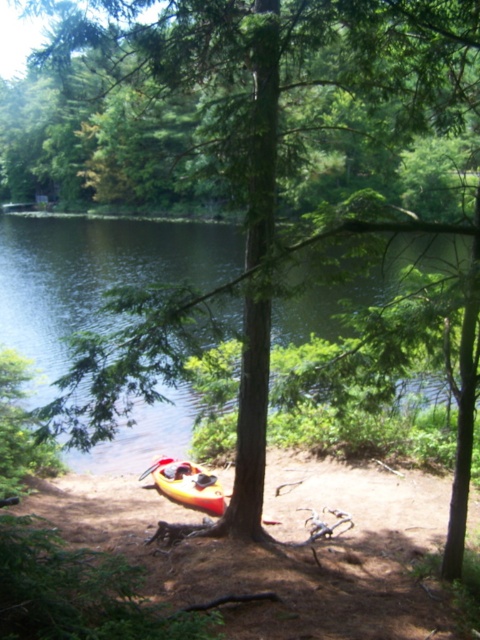
You are standing at the edge of the lake and want to determine which of the two points, point (103, 524) or point (190, 480), is closer to you. Based on the scene, which point is nearer?

Point (103, 524) is closer to the viewer than point (190, 480).

Based on the photo, you are planning to launch a small boat from the shore where the orange kayak at lower center is located. The boat requires a minimum of 30 meters of open water to safely navigate away from the shore. Based on the scene, can the green liquid water at lower center provide enough space for the boat to launch safely?

The orange kayak at lower center and green liquid water at lower center are 30.26 meters apart from each other. Since the required minimum distance is 30 meters, the green liquid water at lower center provides sufficient space for the boat to launch safely.